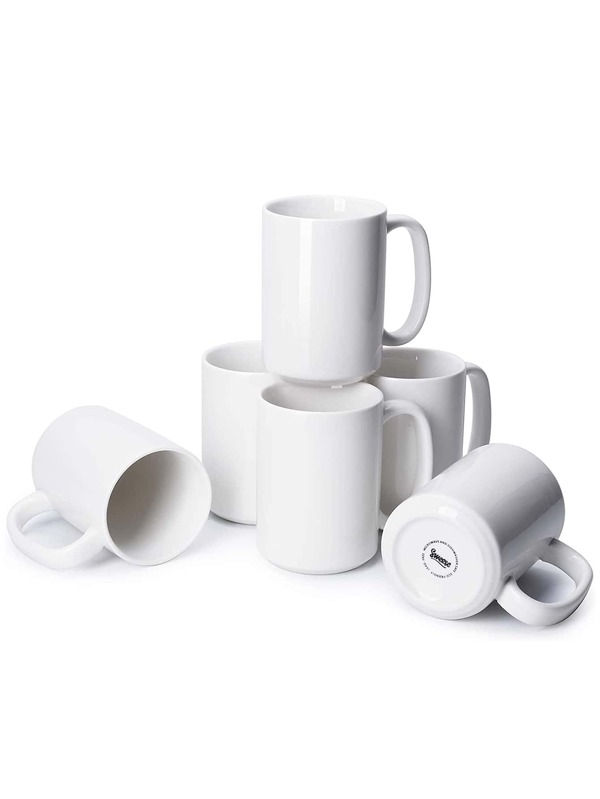
You are a GUI agent. You are given a task and a screenshot of the screen. Output one action in this format:
    pyautogui.click(x=<x>, y=<y>)
    Task: Click on the mug
    This screenshot has height=799, width=600.
    Given the screenshot: What is the action you would take?
    pyautogui.click(x=97, y=455), pyautogui.click(x=353, y=499), pyautogui.click(x=483, y=539), pyautogui.click(x=447, y=392), pyautogui.click(x=209, y=392), pyautogui.click(x=322, y=309)